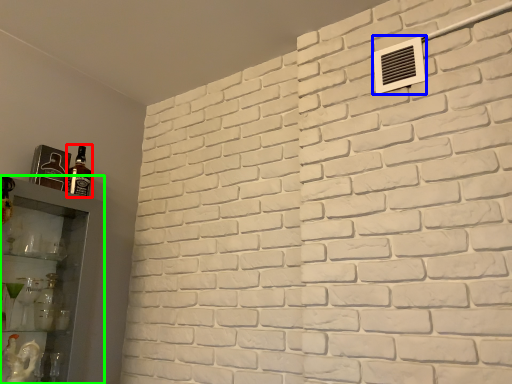
Question: Which object is the farthest from bottle (highlighted by a red box)? Choose among these: air conditioning (highlighted by a blue box) or shelf (highlighted by a green box).

Choices:
 (A) air conditioning
 (B) shelf

Answer: (A)